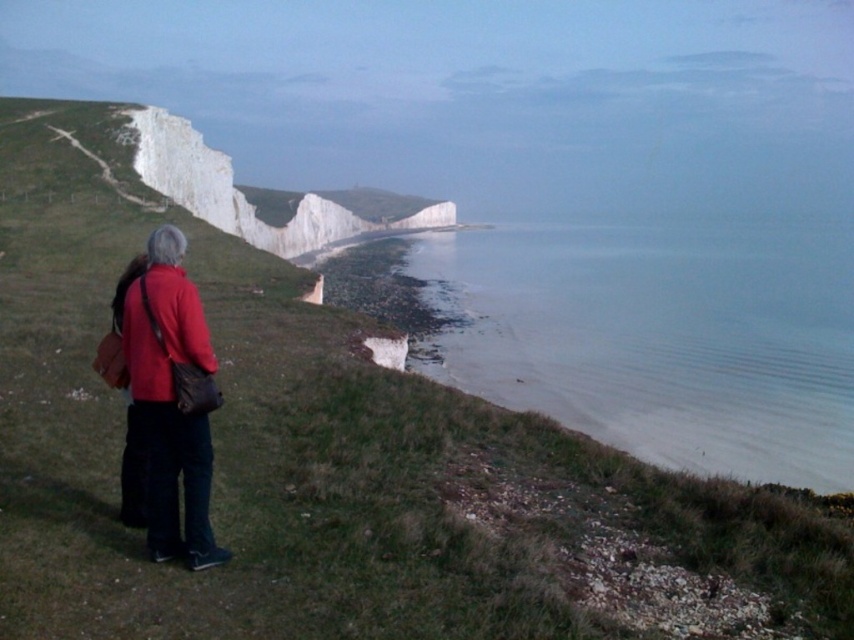
Based on the photo, you are standing on the cliff and see the point marked at coordinates [657,337]. What is the location of this point relative to the clear water at lower right?

The point at [657,337] is located on the clear water at lower right.

You are a photographer trying to capture both the matte red jacket at lower left and the matte red coat at lower left in a single frame. Based on their sizes in the image, which one should you focus on to ensure both are visible without cropping?

The matte red jacket at lower left occupies less space than the matte red coat at lower left. To ensure both are visible without cropping, focus on the smaller matte red jacket at lower left as the reference point, allowing the larger matte red coat at lower left to fit within the frame.

You are a hiker standing on the cliff and want to reach the clear water at lower right from the matte red coat at lower left. Can you safely walk down the cliff directly between them?

The distance between clear water at lower right and matte red coat at lower left is 53.54 meters, but this distance does not indicate the safety of the path. The steep cliffs described in the scene suggest a dangerous descent, so it is not safe to attempt walking down directly.